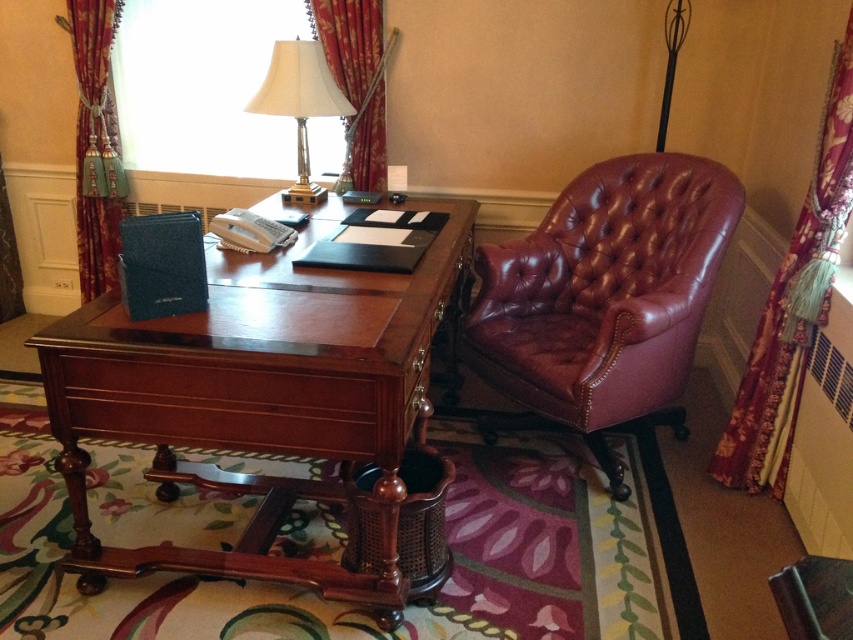
Between floral fabric curtain at right and velvet burgundy curtain at upper left, which one appears on the right side from the viewer's perspective?

Positioned to the right is floral fabric curtain at right.

Is floral fabric curtain at right bigger than velvet burgundy curtain at upper left?

Yes, floral fabric curtain at right is bigger than velvet burgundy curtain at upper left.

Does point (846, 208) lie behind point (346, 125)?

No, it is in front of (346, 125).

Identify the location of floral fabric curtain at right. The width and height of the screenshot is (853, 640). (793, 307).

Does mahogany wood desk at center have a smaller size compared to white fabric lampshade at upper center?

Actually, mahogany wood desk at center might be larger than white fabric lampshade at upper center.

Measure the distance between mahogany wood desk at center and camera.

mahogany wood desk at center and camera are 5.09 feet apart.

Does point (354, 417) come behind point (302, 145)?

No, it is in front of (302, 145).

Find the location of a particular element. mahogany wood desk at center is located at coordinates (260, 400).

Which is more to the right, velvet burgundy curtain at left or velvet burgundy curtain at upper left?

velvet burgundy curtain at upper left is more to the right.

This screenshot has height=640, width=853. Find the location of `velvet burgundy curtain at left`. velvet burgundy curtain at left is located at coordinates (94, 147).

What are the coordinates of `velvet burgundy curtain at left` in the screenshot? It's located at (94, 147).